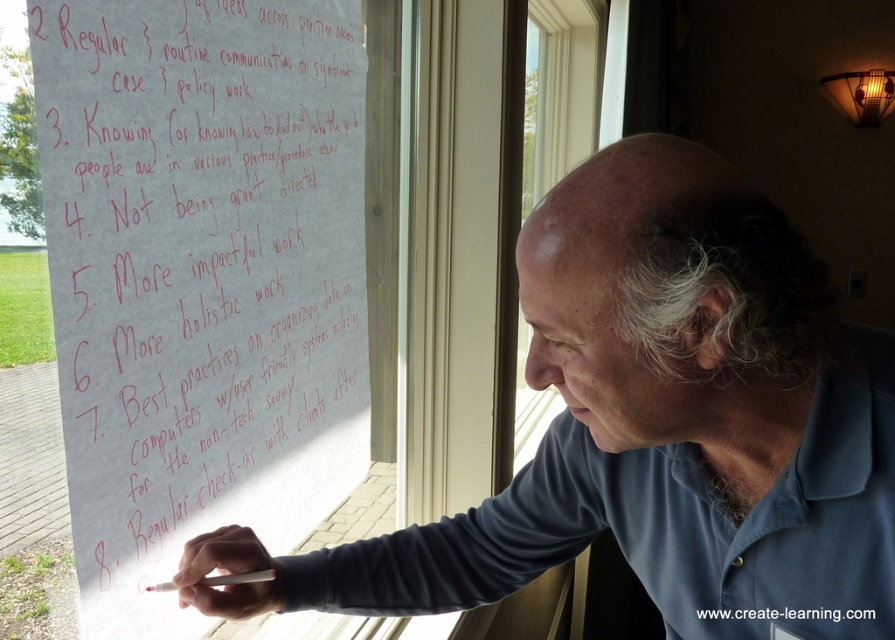
Question: Which object is closer to the camera taking this photo?

Choices:
 (A) white handwritten paper at upper left
 (B) clear glass window at center
 (C) blue cotton shirt at center

Answer: (C)

Question: Is blue cotton shirt at center to the left of clear glass window at center from the viewer's perspective?

Choices:
 (A) yes
 (B) no

Answer: (A)

Question: Does clear glass window at center have a greater width compared to white matte cigarette at lower center?

Choices:
 (A) no
 (B) yes

Answer: (B)

Question: Estimate the real-world distances between objects in this image. Which object is closer to the blue cotton shirt at center?

Choices:
 (A) white handwritten paper at upper left
 (B) clear glass window at center
 (C) white matte cigarette at lower center

Answer: (C)

Question: Does blue cotton shirt at center appear over clear glass window at center?

Choices:
 (A) no
 (B) yes

Answer: (A)

Question: Which of the following is the closest to the observer?

Choices:
 (A) (680, 275)
 (B) (151, 275)
 (C) (564, 32)
 (D) (273, 572)

Answer: (A)